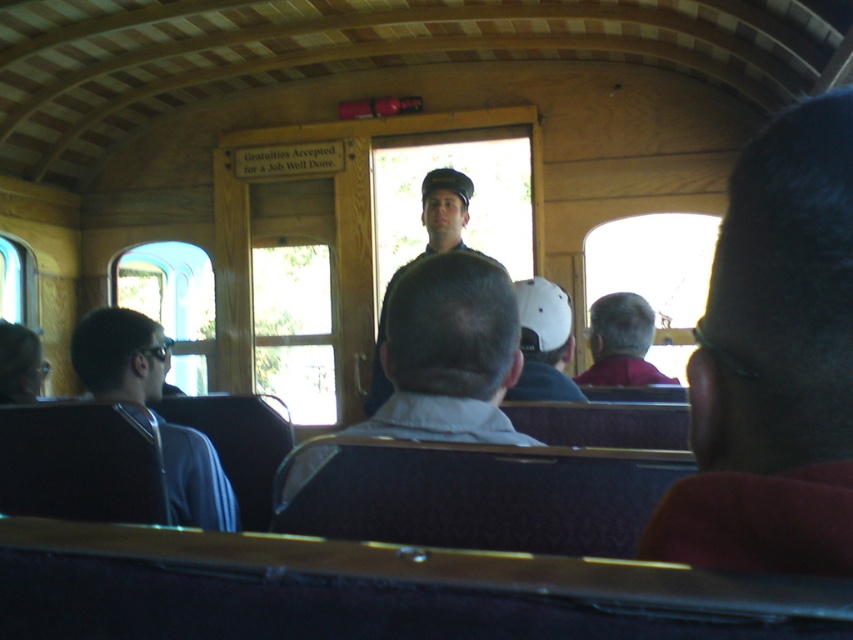
Question: Can you confirm if light brown leather jacket at center is wider than blue fabric jacket at left?

Choices:
 (A) yes
 (B) no

Answer: (B)

Question: Can you confirm if white matte baseball cap at center is smaller than gray hair at center?

Choices:
 (A) no
 (B) yes

Answer: (B)

Question: Is light brown leather jacket at center wider than uniformed man at center?

Choices:
 (A) yes
 (B) no

Answer: (B)

Question: Which point is closer to the camera?

Choices:
 (A) light brown leather jacket at center
 (B) gray hair at center
 (C) blue fabric jacket at left
 (D) dark brown hair at upper right

Answer: (D)

Question: Which of these objects is positioned closest to the light brown leather jacket at center?

Choices:
 (A) dark brown hair at upper right
 (B) gray hair at center

Answer: (A)

Question: Which of the following is the closest to the observer?

Choices:
 (A) (105, 358)
 (B) (544, 288)
 (C) (811, 195)
 (D) (370, 424)

Answer: (C)